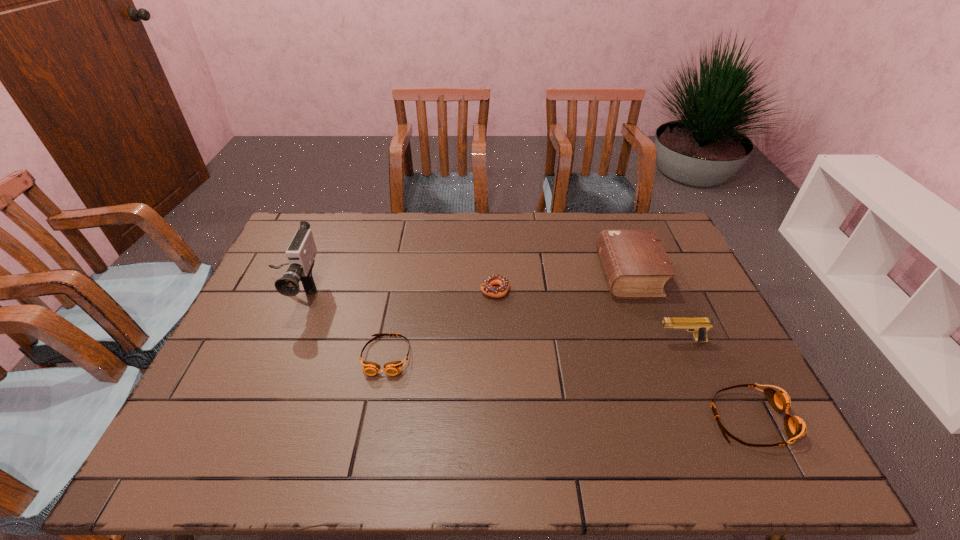
At what (x,y) coordinates should I click in order to perform the action: click on free space between the camcorder and the shorter goggles. Please return your answer as a coordinate pair (x, y). Looking at the image, I should click on (340, 323).

What are the coordinates of `vacant region between the Bible and the third object from left to right` in the screenshot? It's located at (563, 282).

Identify which object is the fourth closest to the leftmost object. Please provide its 2D coordinates. Your answer should be formatted as a tuple, i.e. [(x, y)], where the tuple contains the x and y coordinates of a point satisfying the conditions above.

[(699, 326)]

Find the location of `the closest object to the Bible`. the closest object to the Bible is located at coordinates (699, 326).

You are a GUI agent. You are given a task and a screenshot of the screen. Output one action in this format:
    pyautogui.click(x=<x>, y=<y>)
    Task: Click on the free space that satisfies the following two spatial constraints: 1. on the spine side of the Bible; 2. with the lenses facing forward on the left goggles
    The image size is (960, 540).
    Given the screenshot: What is the action you would take?
    [x=660, y=356]

The image size is (960, 540). Find the location of `free space that satisfies the following two spatial constraints: 1. on the spine side of the Bible; 2. on the recording direction of the tallest object`. free space that satisfies the following two spatial constraints: 1. on the spine side of the Bible; 2. on the recording direction of the tallest object is located at coordinates (636, 291).

Find the location of a particular element. This screenshot has width=960, height=540. free space that satisfies the following two spatial constraints: 1. at the barrel of the pistol; 2. with the lenses facing forward on the shorter goggles is located at coordinates (687, 356).